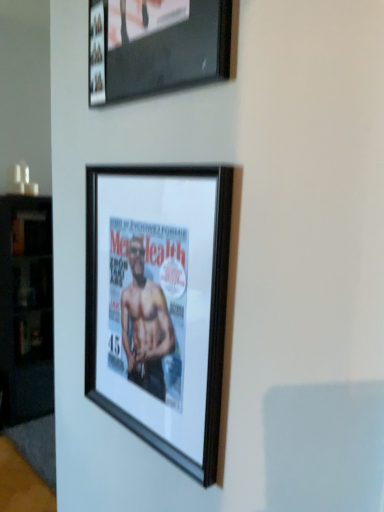
Question: Can you confirm if black wood cabinet at left is bigger than black matte picture frame at center, the 2th picture frame when ordered from top to bottom?

Choices:
 (A) yes
 (B) no

Answer: (A)

Question: Considering the relative sizes of black wood cabinet at left and black matte picture frame at center, which appears as the first picture frame when ordered from the bottom, in the image provided, is black wood cabinet at left thinner than black matte picture frame at center, which appears as the first picture frame when ordered from the bottom,?

Choices:
 (A) no
 (B) yes

Answer: (A)

Question: Does black wood cabinet at left have a greater height compared to black matte picture frame at center, the 2th picture frame when ordered from top to bottom?

Choices:
 (A) no
 (B) yes

Answer: (B)

Question: Considering the relative positions of black wood cabinet at left and black matte picture frame at center, which appears as the first picture frame when ordered from the bottom, in the image provided, is black wood cabinet at left to the left of black matte picture frame at center, which appears as the first picture frame when ordered from the bottom, from the viewer's perspective?

Choices:
 (A) no
 (B) yes

Answer: (B)

Question: From a real-world perspective, does black wood cabinet at left stand above black matte picture frame at center, which appears as the first picture frame when ordered from the bottom?

Choices:
 (A) no
 (B) yes

Answer: (A)

Question: From their relative heights in the image, would you say black wood cabinet at left is taller or shorter than matte black picture frame at upper center, which appears as the first picture frame when viewed from the top?

Choices:
 (A) tall
 (B) short

Answer: (A)

Question: Looking at the image, does black wood cabinet at left seem bigger or smaller compared to matte black picture frame at upper center, which appears as the first picture frame when viewed from the top?

Choices:
 (A) big
 (B) small

Answer: (A)

Question: From a real-world perspective, is black wood cabinet at left above or below matte black picture frame at upper center, which appears as the first picture frame when viewed from the top?

Choices:
 (A) below
 (B) above

Answer: (A)

Question: Based on their positions, is black wood cabinet at left located to the left or right of matte black picture frame at upper center, the second picture frame when ordered from bottom to top?

Choices:
 (A) right
 (B) left

Answer: (B)

Question: From their relative heights in the image, would you say matte black picture frame at upper center, which appears as the first picture frame when viewed from the top, is taller or shorter than black wood cabinet at left?

Choices:
 (A) tall
 (B) short

Answer: (B)

Question: Is matte black picture frame at upper center, the second picture frame when ordered from bottom to top, inside or outside of black wood cabinet at left?

Choices:
 (A) outside
 (B) inside

Answer: (A)

Question: From a real-world perspective, relative to black wood cabinet at left, is matte black picture frame at upper center, the second picture frame when ordered from bottom to top, vertically above or below?

Choices:
 (A) below
 (B) above

Answer: (B)

Question: In terms of width, does matte black picture frame at upper center, the second picture frame when ordered from bottom to top, look wider or thinner when compared to black wood cabinet at left?

Choices:
 (A) wide
 (B) thin

Answer: (B)

Question: Considering the positions of black wood cabinet at left and black matte picture frame at center, the 2th picture frame when ordered from top to bottom, in the image, is black wood cabinet at left bigger or smaller than black matte picture frame at center, the 2th picture frame when ordered from top to bottom,?

Choices:
 (A) big
 (B) small

Answer: (A)

Question: Visually, is black wood cabinet at left positioned to the left or to the right of black matte picture frame at center, which appears as the first picture frame when ordered from the bottom?

Choices:
 (A) left
 (B) right

Answer: (A)